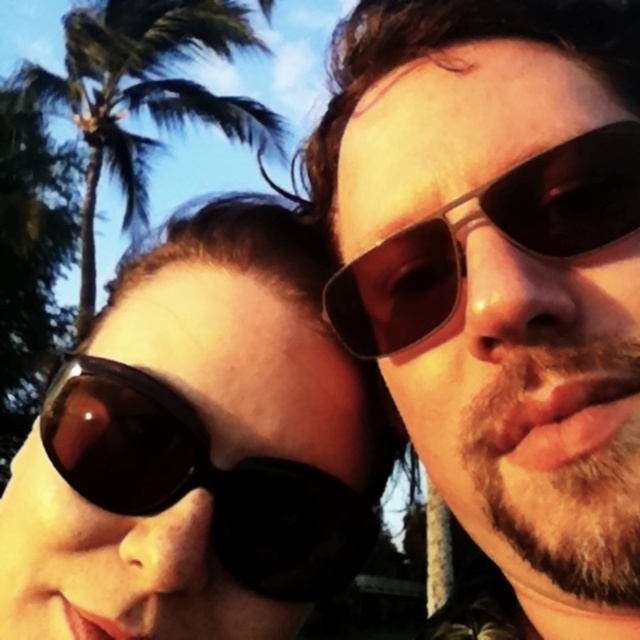
Question: Which point is farther to the camera?

Choices:
 (A) green leafy palm tree at upper left
 (B) matte black sunglasses at left
 (C) matte black goggles at left

Answer: (A)

Question: Which object appears farthest from the camera in this image?

Choices:
 (A) green leafy palm tree at upper left
 (B) matte black sunglasses at left

Answer: (A)

Question: From the image, what is the correct spatial relationship of matte black goggles at left in relation to green leafy palm tree at upper left?

Choices:
 (A) above
 (B) below

Answer: (B)

Question: Which object is closer to the camera taking this photo?

Choices:
 (A) matte black sunglasses at left
 (B) matte black sunglasses at right
 (C) matte black goggles at left
 (D) green leafy palm tree at upper left

Answer: (B)

Question: Does matte black sunglasses at left appear over matte black goggles at left?

Choices:
 (A) no
 (B) yes

Answer: (B)

Question: Can you confirm if matte black goggles at left is positioned below green leafy palm tree at upper left?

Choices:
 (A) yes
 (B) no

Answer: (A)